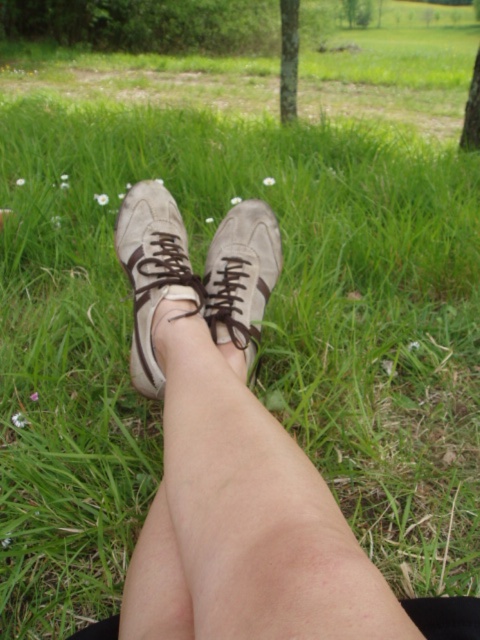
Between suede/leather sneaker at center and green leafy tree at upper center, which one has less height?

With less height is suede/leather sneaker at center.

Does point (255, 257) lie behind point (476, 83)?

That is False.

At what (x,y) coordinates should I click in order to perform the action: click on suede/leather sneaker at center. Please return your answer as a coordinate pair (x, y). The height and width of the screenshot is (640, 480). Looking at the image, I should click on (241, 276).

Does matte beige sneaker at center appear under green leafy tree at upper center?

Correct, matte beige sneaker at center is located below green leafy tree at upper center.

Who is more distant from viewer, (146,330) or (471,76)?

The point (471,76) is behind.

This screenshot has height=640, width=480. I want to click on matte beige sneaker at center, so click(153, 272).

Which is in front, point (179, 236) or point (228, 330)?

Positioned in front is point (228, 330).

Can you confirm if matte beige sneaker at center is wider than suede/leather sneaker at center?

Yes.

Locate an element on the screen. Image resolution: width=480 pixels, height=640 pixels. matte beige sneaker at center is located at coordinates (153, 272).